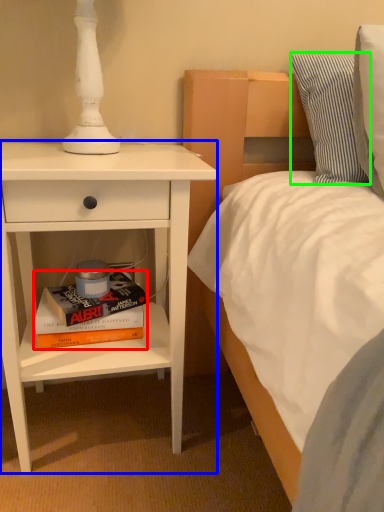
Question: Which is farther away from book (highlighted by a red box)? nightstand (highlighted by a blue box) or pillow (highlighted by a green box)?

Choices:
 (A) nightstand
 (B) pillow

Answer: (B)